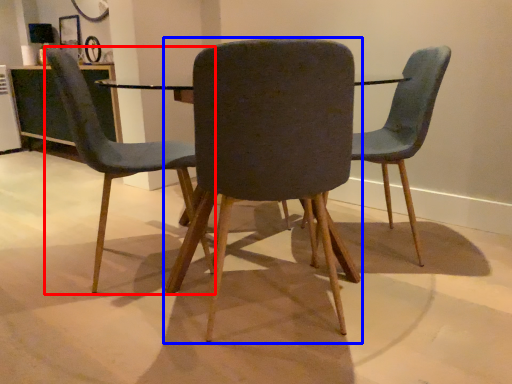
Question: Which object is closer to the camera taking this photo, chair (highlighted by a red box) or chair (highlighted by a blue box)?

Choices:
 (A) chair
 (B) chair

Answer: (B)